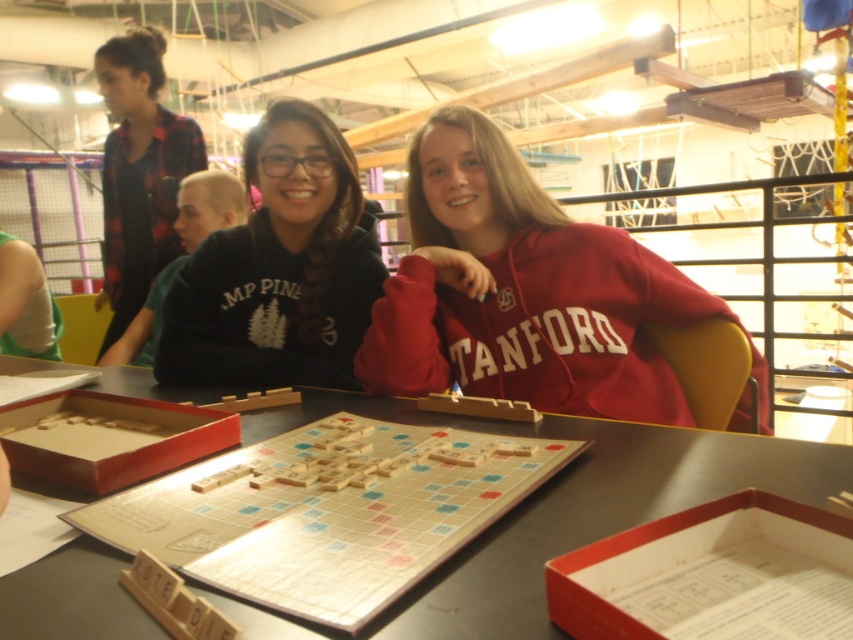
You are a game piece that is 2 centimeters wide. You want to move from the red matte stanford hoodie at center to the wooden scrabble board at center. Can you fit through the space between them?

The distance between the red matte stanford hoodie at center and the wooden scrabble board at center is 38.57 centimeters. Since the game piece is only 2 centimeters wide, it can easily move through the space between them.

You are standing in the room and want to place a new item exactly at the coordinates where the red matte stanford hoodie at center is located. What object is currently occupying that position?

The red matte stanford hoodie at center is located at point (521,291), so that position is currently occupied by the red matte stanford hoodie at center.

You are a photographer trying to capture a closeup of the wooden scrabble board at center without blocking the view of the black matte sweatshirt at center. Based on their positions, is this possible?

The wooden scrabble board at center is below the black matte sweatshirt at center, so you can position yourself to capture the board while keeping the sweatshirt out of the frame by angling the camera downward.